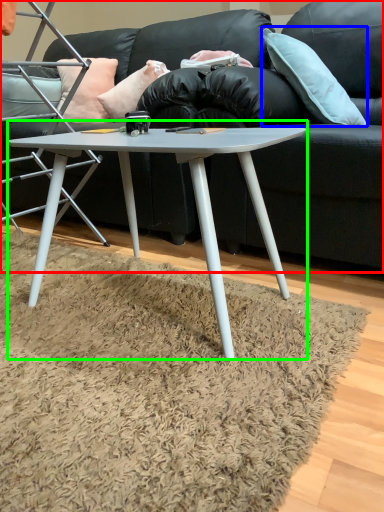
Question: Which is farther away from studio couch (highlighted by a red box)? pillow (highlighted by a blue box) or coffee table (highlighted by a green box)?

Choices:
 (A) pillow
 (B) coffee table

Answer: (B)